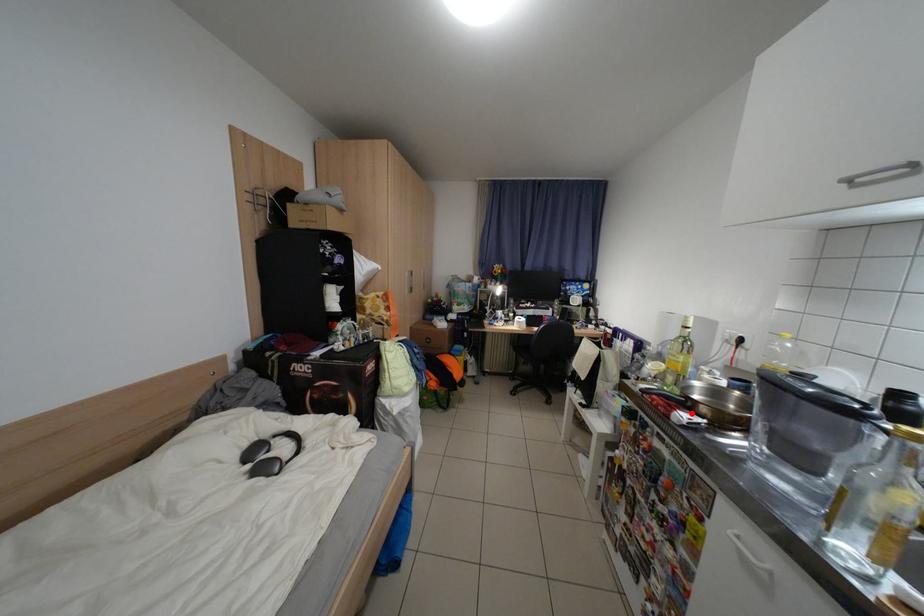
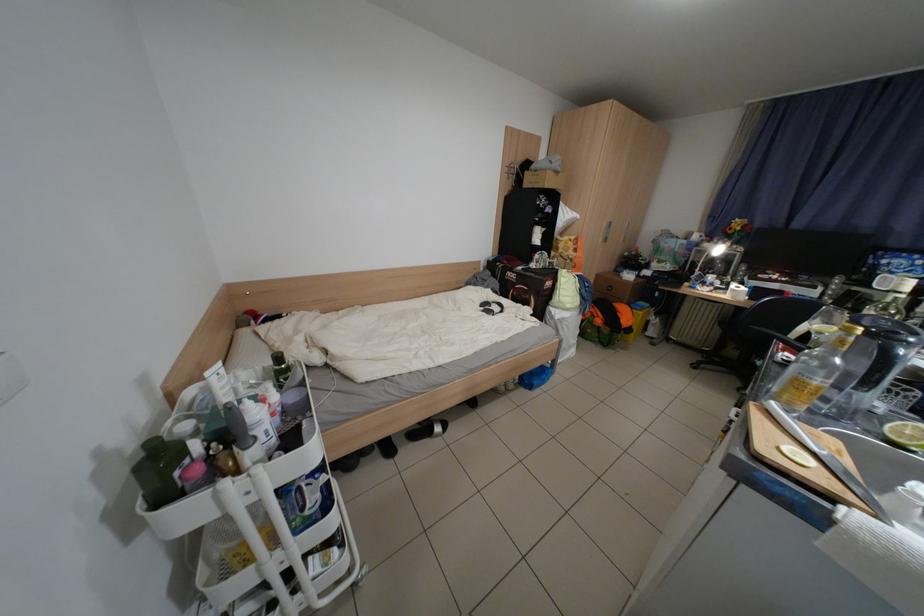
The point at the highlighted location is marked in the first image. Where is the corresponding point in the second image?

(799, 355)